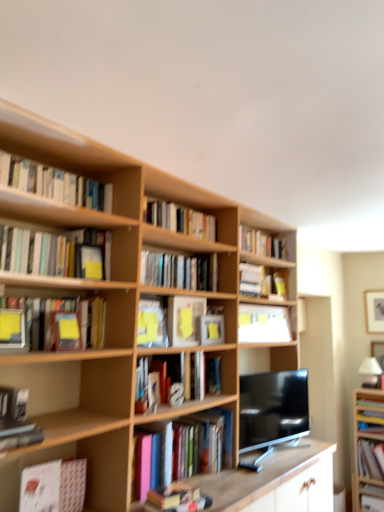
The image size is (384, 512). Identify the location of free space above light wood bookcase at upper left, which is counted as the 2th bookcase, starting from the bottom (from a real-world perspective). (205, 186).